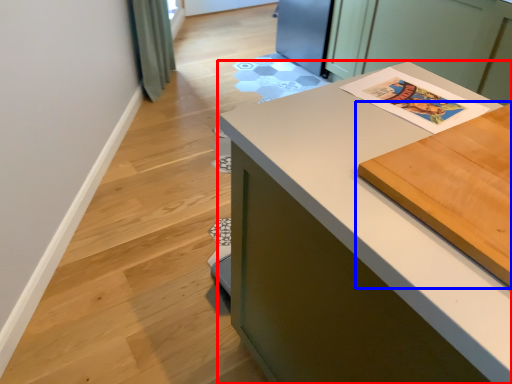
Question: Which object is further to the camera taking this photo, countertop (highlighted by a red box) or table (highlighted by a blue box)?

Choices:
 (A) countertop
 (B) table

Answer: (A)